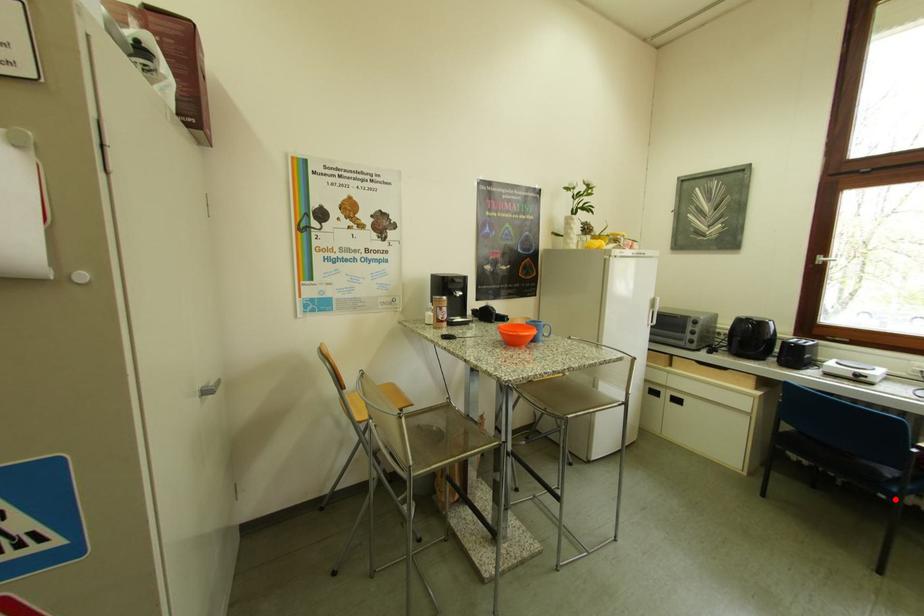
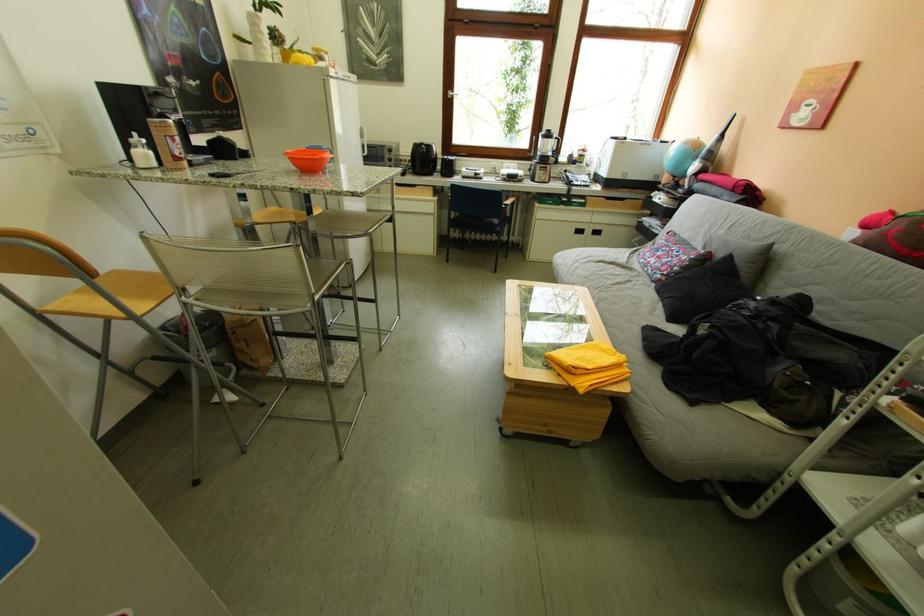
Locate, in the second image, the point that corresponds to the highlighted location in the first image.

(507, 238)